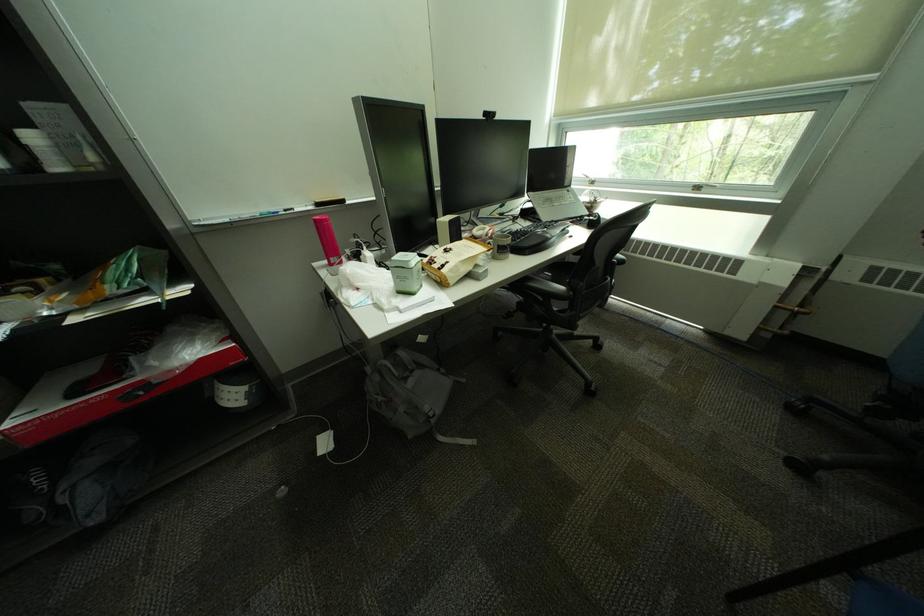
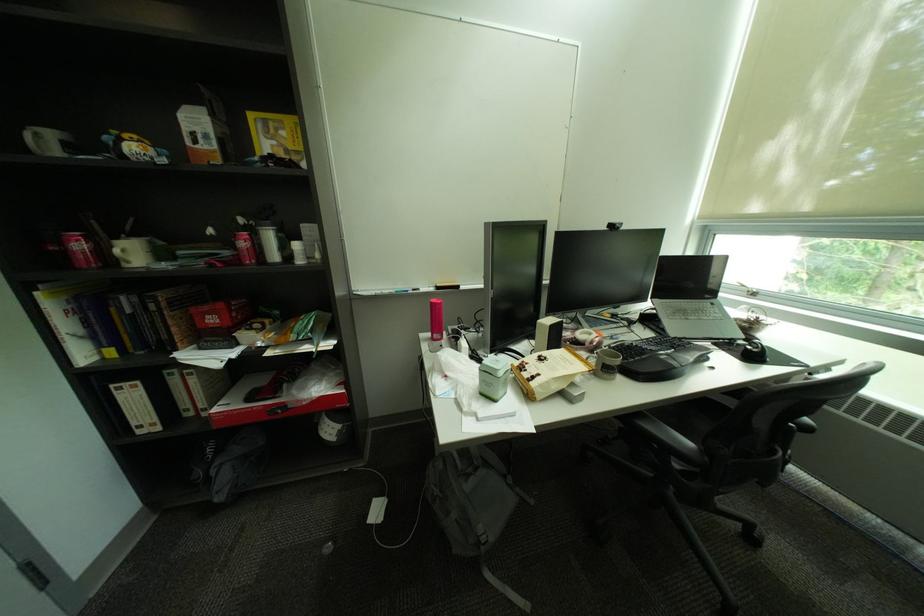
The point at (x=573, y=288) is marked in the first image. Where is the corresponding point in the second image?

(700, 445)